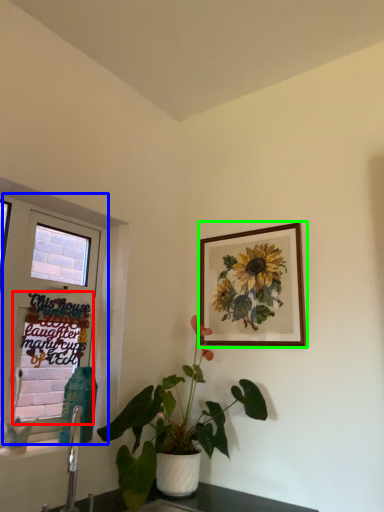
Question: Which object is positioned farthest from window screen (highlighted by a red box)? Select from window (highlighted by a blue box) and picture frame (highlighted by a green box).

Choices:
 (A) window
 (B) picture frame

Answer: (B)